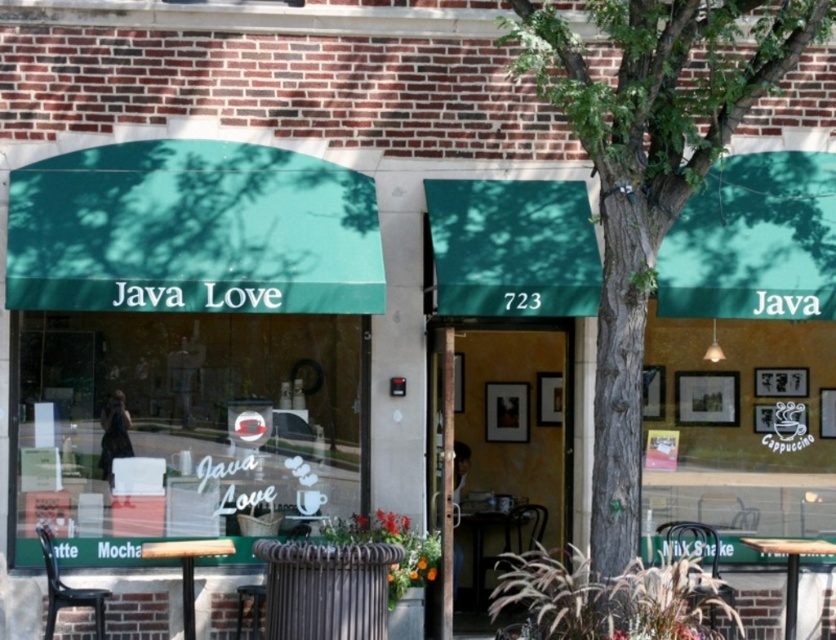
Is wooden table at lower left positioned at the back of wooden table at lower right?

No, it is in front of wooden table at lower right.

Which is behind, point (177, 545) or point (784, 627)?

The point (784, 627) is more distant.

The width and height of the screenshot is (836, 640). Identify the location of wooden table at lower left. [187, 566].

Who is more distant from viewer, (536, 72) or (186, 564)?

Positioned behind is point (186, 564).

Who is higher up, green textured tree at center or wooden table at lower left?

Positioned higher is green textured tree at center.

Is point (625, 49) positioned before point (182, 552)?

That is True.

This screenshot has width=836, height=640. In order to click on green textured tree at center in this screenshot , I will do `click(650, 176)`.

Does green textured tree at center have a larger size compared to wooden table at lower right?

Correct, green textured tree at center is larger in size than wooden table at lower right.

Does green textured tree at center have a smaller size compared to wooden table at lower right?

Actually, green textured tree at center might be larger than wooden table at lower right.

You are a GUI agent. You are given a task and a screenshot of the screen. Output one action in this format:
    pyautogui.click(x=<x>, y=<y>)
    Task: Click on the green textured tree at center
    
    Given the screenshot: What is the action you would take?
    pyautogui.click(x=650, y=176)

At what (x,y) coordinates should I click in order to perform the action: click on green textured tree at center. Please return your answer as a coordinate pair (x, y). This screenshot has height=640, width=836. Looking at the image, I should click on (650, 176).